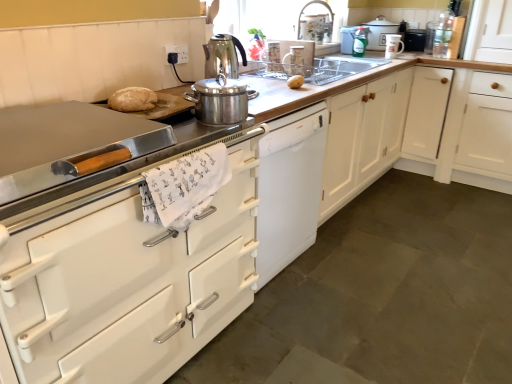
Locate an element on the screen. vacant region in front of clear glass pitcher at upper center, marked as the 3th kitchen appliance in a front-to-back arrangement is located at coordinates (296, 74).